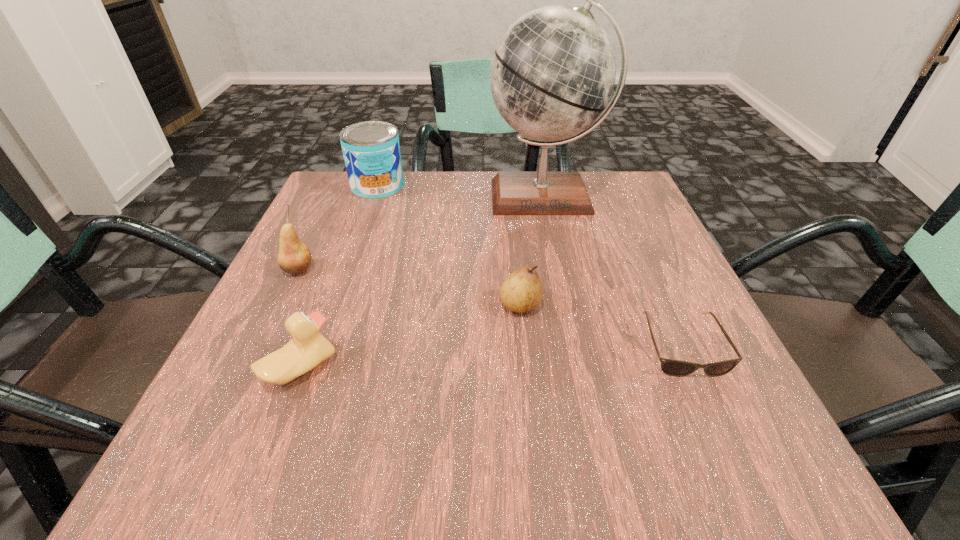
The height and width of the screenshot is (540, 960). I want to click on object that is the third closest one to the duck, so click(553, 72).

Locate an element on the screen. free region that satisfies the following two spatial constraints: 1. on the front side of the can; 2. at the beak of the duck is located at coordinates (314, 368).

At what (x,y) coordinates should I click in order to perform the action: click on free point that satisfies the following two spatial constraints: 1. at the equator of the globe; 2. at the beak of the duck. Please return your answer as a coordinate pair (x, y). This screenshot has height=540, width=960. Looking at the image, I should click on (581, 368).

Locate an element on the screen. The image size is (960, 540). vacant area in the image that satisfies the following two spatial constraints: 1. on the front side of the nearer pear; 2. on the left side of the taller pear is located at coordinates (281, 306).

Where is `free space in the image that satisfies the following two spatial constraints: 1. at the equator of the tallest object; 2. at the beak of the duck`? This screenshot has width=960, height=540. free space in the image that satisfies the following two spatial constraints: 1. at the equator of the tallest object; 2. at the beak of the duck is located at coordinates [x=581, y=368].

Locate an element on the screen. free location that satisfies the following two spatial constraints: 1. at the equator of the tallest object; 2. at the beak of the duck is located at coordinates (581, 368).